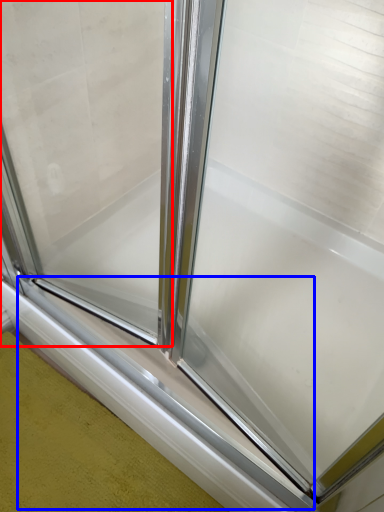
Question: Among these objects, which one is farthest to the camera, window screen (highlighted by a red box) or window sill (highlighted by a blue box)?

Choices:
 (A) window screen
 (B) window sill

Answer: (B)